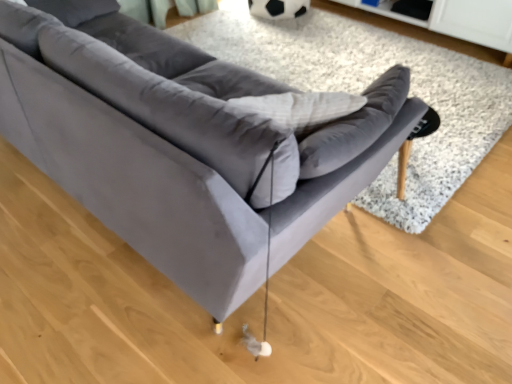
You are a GUI agent. You are given a task and a screenshot of the screen. Output one action in this format:
    pyautogui.click(x=<x>, y=<y>)
    Task: Click on the velvet gray couch at center
    This screenshot has height=384, width=512.
    Given the screenshot: What is the action you would take?
    pyautogui.click(x=183, y=145)

Describe the element at coordinates (183, 145) in the screenshot. I see `velvet gray couch at center` at that location.

Measure the distance between point (264, 185) and camera.

Point (264, 185) and camera are 95.70 centimeters apart.

This screenshot has width=512, height=384. What do you see at coordinates (367, 85) in the screenshot?
I see `velvet gray sofa at center` at bounding box center [367, 85].

The height and width of the screenshot is (384, 512). In order to click on velvet gray sofa at center in this screenshot , I will do `click(367, 85)`.

At what (x,y) coordinates should I click in order to perform the action: click on velvet gray couch at center. Please return your answer as a coordinate pair (x, y). Looking at the image, I should click on (183, 145).

Considering the relative positions of velvet gray couch at center and velvet gray sofa at center in the image provided, is velvet gray couch at center to the left or to the right of velvet gray sofa at center?

velvet gray couch at center is to the left of velvet gray sofa at center.

Which object is closer to the camera, velvet gray couch at center or velvet gray sofa at center?

velvet gray couch at center is closer to the camera.

Considering the positions of points (148, 33) and (316, 29), is point (148, 33) closer to camera compared to point (316, 29)?

Yes, point (148, 33) is closer to viewer.

From the image's perspective, is velvet gray couch at center above or below velvet gray sofa at center?

velvet gray couch at center is below velvet gray sofa at center.

From a real-world perspective, between velvet gray couch at center and velvet gray sofa at center, who is vertically higher?

In real-world perspective, velvet gray couch at center is above.

In terms of width, does velvet gray couch at center look wider or thinner when compared to velvet gray sofa at center?

In the image, velvet gray couch at center appears to be more narrow than velvet gray sofa at center.

Does velvet gray couch at center have a greater height compared to velvet gray sofa at center?

Indeed, velvet gray couch at center has a greater height compared to velvet gray sofa at center.

Considering the sizes of objects velvet gray couch at center and velvet gray sofa at center in the image provided, who is smaller, velvet gray couch at center or velvet gray sofa at center?

Smaller between the two is velvet gray sofa at center.

Is velvet gray couch at center inside or outside of velvet gray sofa at center?

velvet gray couch at center is outside velvet gray sofa at center.

Is velvet gray couch at center beside velvet gray sofa at center?

No.

Is velvet gray sofa at center at the back of velvet gray couch at center?

velvet gray couch at center is not turned away from velvet gray sofa at center.

The image size is (512, 384). What are the coordinates of `mat beneath the velvet gray couch at center (from a real-world perspective)` in the screenshot? It's located at (367, 85).

Does velvet gray sofa at center appear on the left side of velvet gray couch at center?

In fact, velvet gray sofa at center is to the right of velvet gray couch at center.

Is velvet gray sofa at center further to camera compared to velvet gray couch at center?

Yes.

Between point (377, 187) and point (76, 179), which one is positioned behind?

Positioned behind is point (377, 187).

From the image's perspective, between velvet gray sofa at center and velvet gray couch at center, who is located below?

velvet gray couch at center, from the image's perspective.

From a real-world perspective, is velvet gray sofa at center positioned over velvet gray couch at center based on gravity?

No, from a real-world perspective, velvet gray sofa at center is not on top of velvet gray couch at center.

In terms of width, does velvet gray sofa at center look wider or thinner when compared to velvet gray couch at center?

Considering their sizes, velvet gray sofa at center looks broader than velvet gray couch at center.

Based on the photo, considering the relative sizes of velvet gray sofa at center and velvet gray couch at center in the image provided, is velvet gray sofa at center taller than velvet gray couch at center?

Incorrect, the height of velvet gray sofa at center is not larger of that of velvet gray couch at center.

Considering the relative sizes of velvet gray sofa at center and velvet gray couch at center in the image provided, is velvet gray sofa at center smaller than velvet gray couch at center?

Yes, velvet gray sofa at center is smaller than velvet gray couch at center.

In the scene shown: Is velvet gray sofa at center spatially inside velvet gray couch at center, or outside of it?

The correct answer is: outside.

Are velvet gray sofa at center and velvet gray couch at center located far from each other?

velvet gray sofa at center is far away from velvet gray couch at center.

Is velvet gray sofa at center aimed at velvet gray couch at center?

Yes, velvet gray sofa at center is turned towards velvet gray couch at center.

What's the angular difference between velvet gray sofa at center and velvet gray couch at center's facing directions?

velvet gray sofa at center and velvet gray couch at center are facing 180 degrees away from each other.

How far apart are velvet gray sofa at center and velvet gray couch at center?

The distance of velvet gray sofa at center from velvet gray couch at center is 1.19 meters.

The height and width of the screenshot is (384, 512). I want to click on mat that is under the velvet gray couch at center (from a real-world perspective), so click(367, 85).

This screenshot has width=512, height=384. I want to click on mat that appears on the right of velvet gray couch at center, so click(x=367, y=85).

Locate an element on the screen. mat behind the velvet gray couch at center is located at coordinates (367, 85).